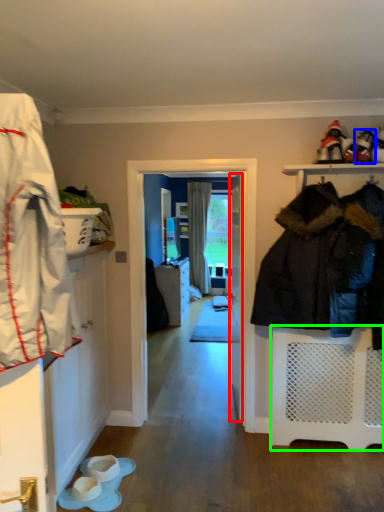
Question: Which object is positioned farthest from door (highlighted by a red box)? Select from footwear (highlighted by a blue box) and shelf (highlighted by a green box).

Choices:
 (A) footwear
 (B) shelf

Answer: (A)